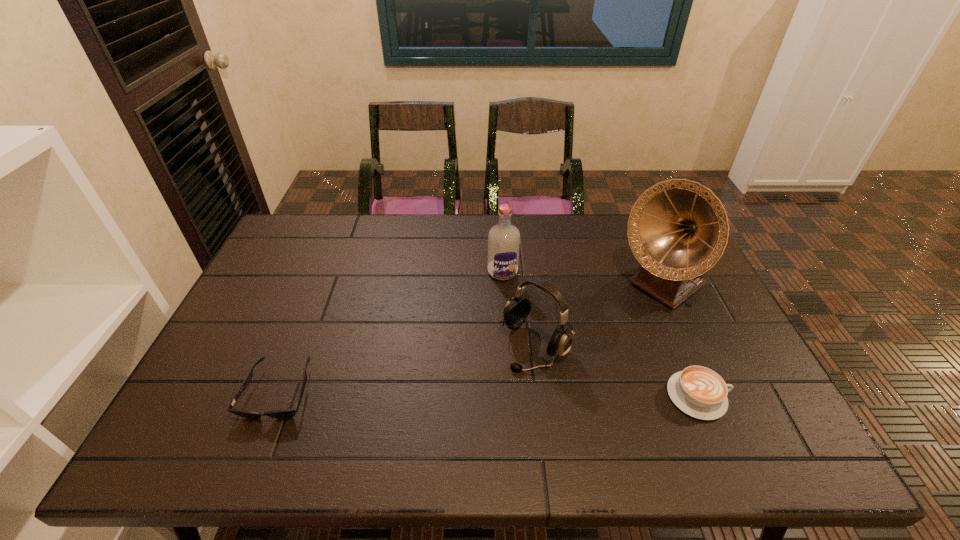
Image resolution: width=960 pixels, height=540 pixels. What are the coordinates of `free space between the third shortest object and the cappuccino` in the screenshot? It's located at (616, 370).

Image resolution: width=960 pixels, height=540 pixels. What are the coordinates of `free area in between the headset and the leftmost object` in the screenshot? It's located at (407, 368).

Where is `vacant area between the cappuccino and the vodka`? This screenshot has width=960, height=540. vacant area between the cappuccino and the vodka is located at coordinates (600, 334).

You are a GUI agent. You are given a task and a screenshot of the screen. Output one action in this format:
    pyautogui.click(x=<x>, y=<y>)
    Task: Click on the free spot between the vodka and the sunglasses
    Image resolution: width=960 pixels, height=540 pixels.
    Given the screenshot: What is the action you would take?
    point(391,332)

Find the location of a particular element. free space between the headset and the sunglasses is located at coordinates (407, 368).

I want to click on vacant space in between the leftmost object and the headset, so click(x=407, y=368).

This screenshot has height=540, width=960. I want to click on object identified as the closest to the leftmost object, so click(x=518, y=307).

Locate which object ranks in proximity to the cappuccino. Please provide its 2D coordinates. Your answer should be formatted as a tuple, i.e. [(x, y)], where the tuple contains the x and y coordinates of a point satisfying the conditions above.

[(678, 229)]

Identify the location of free point that satisfies the following two spatial constraints: 1. on the front-facing side of the cappuccino; 2. on the side of the leftmost object with the handle. Image resolution: width=960 pixels, height=540 pixels. (277, 396).